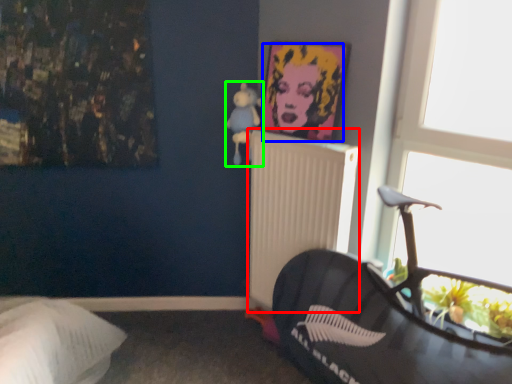
Question: Estimate the real-world distances between objects in this image. Which object is farther from radiator (highlighted by a red box), person (highlighted by a blue box) or toy (highlighted by a green box)?

Choices:
 (A) person
 (B) toy

Answer: (B)